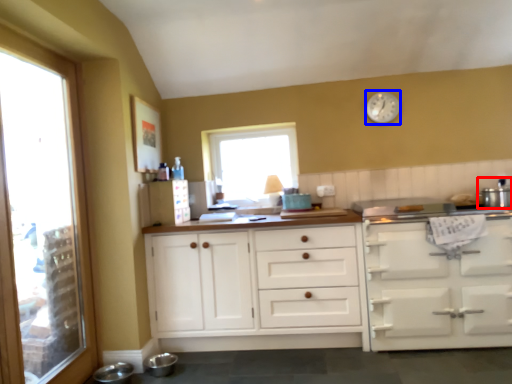
Question: Which object appears farthest to the camera in this image, appliance (highlighted by a red box) or clock (highlighted by a blue box)?

Choices:
 (A) appliance
 (B) clock

Answer: (B)